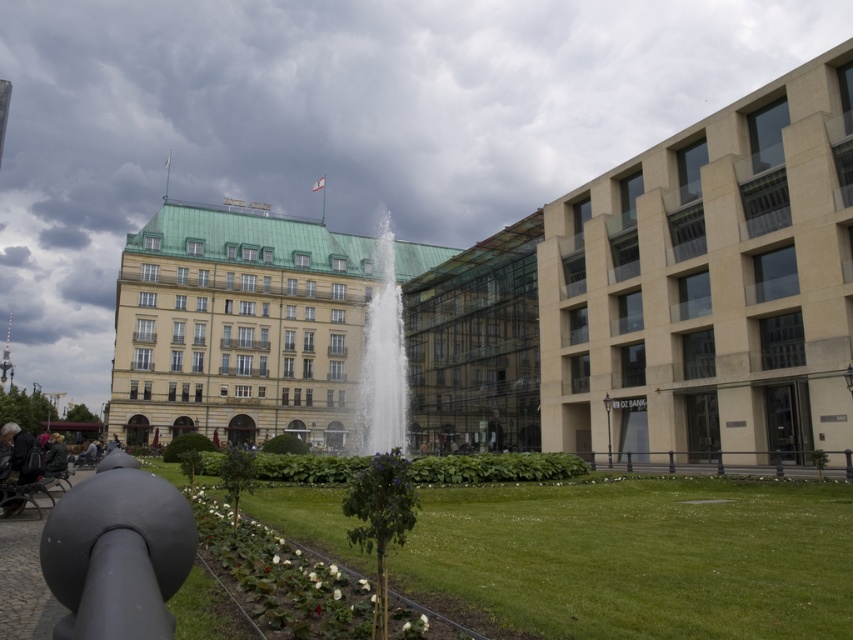
You are standing in the urban plaza and want to reach the point marked at coordinates point (370, 374). If you walk directly towards it from your current position, how far will you have to walk in feet?

The distance between you and the point (370, 374) is 215.26 feet, so you will have to walk 215.26 feet to reach it.

You are standing in the urban plaza and want to take a photo of the cloudy sky at upper center and the matte black cannon at lower left. Which object will appear higher in the photo?

The cloudy sky at upper center will appear higher in the photo because it is located above the matte black cannon at lower left.

You are a tourist standing in the plaza and see the cloudy sky at upper center and the dark gray fabric jacket at lower left. Which object is located to the right of the other?

The cloudy sky at upper center is positioned on the right side of dark gray fabric jacket at lower left.